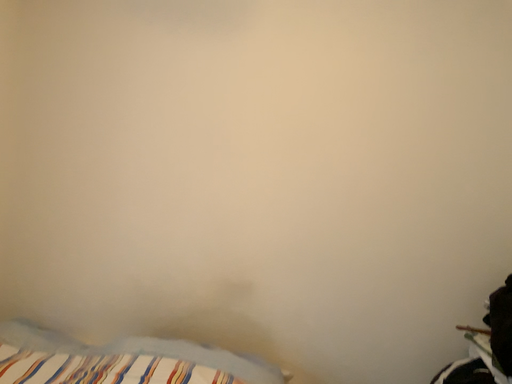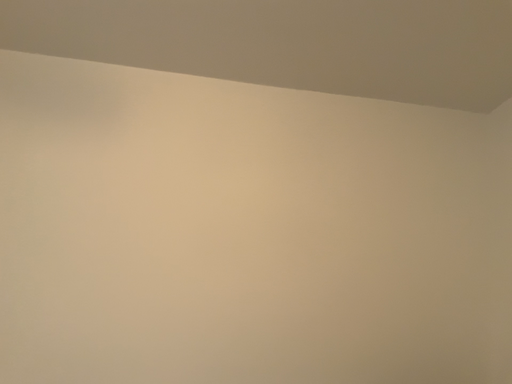
Question: How did the camera likely rotate when shooting the video?

Choices:
 (A) rotated left
 (B) rotated right

Answer: (B)